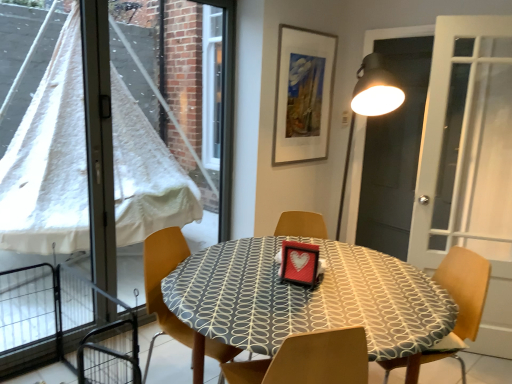
Question: In terms of width, does wooden chair at center, arranged as the 1th chair when viewed from the left, look wider or thinner when compared to black matte screen door at upper right?

Choices:
 (A) wide
 (B) thin

Answer: (A)

Question: Based on their sizes in the image, would you say wooden chair at center, arranged as the 1th chair when viewed from the left, is bigger or smaller than black matte screen door at upper right?

Choices:
 (A) big
 (B) small

Answer: (A)

Question: Based on their relative distances, which object is farther from the patterned fabric table at center?

Choices:
 (A) wooden chair at center, placed as the second chair when sorted from right to left
 (B) matte wooden picture frame at upper center
 (C) black metal gate at lower left
 (D) black matte screen door at upper right
 (E) transparent plastic window at left

Answer: (E)

Question: Which is nearer to the black matte screen door at upper right?

Choices:
 (A) transparent plastic window at left
 (B) black metal gate at lower left
 (C) wooden chair at right, positioned as the first chair in right-to-left order
 (D) wooden chair at center, arranged as the 1th chair when viewed from the left
 (E) matte wooden picture frame at upper center

Answer: (E)